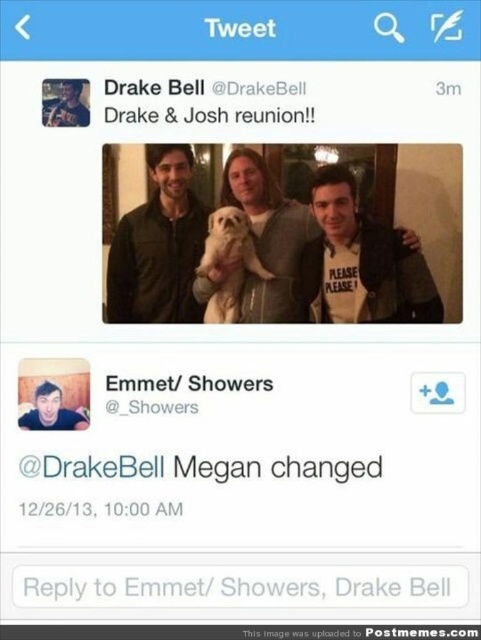
You are a Twitter user who wants to describe the main photo in the tweet. You see the matte green jacket at center and the matte skin face at center. Which one is covering part of the other?

The matte green jacket at center is positioned over matte skin face at center, so the jacket is covering part of the face.

In the Twitter post by DrakBell, there is a photo with three people and a small dog. The reply mentions a point at coordinates (364, 260). What object is located at that point?

The point at coordinates (364, 260) indicates the matte black jacket at center.

In the scene shown: Based on the scene described, which object is wider, the matte green jacket at center or the matte skin face at center?

The matte green jacket at center is wider than the matte skin face at center according to the description.